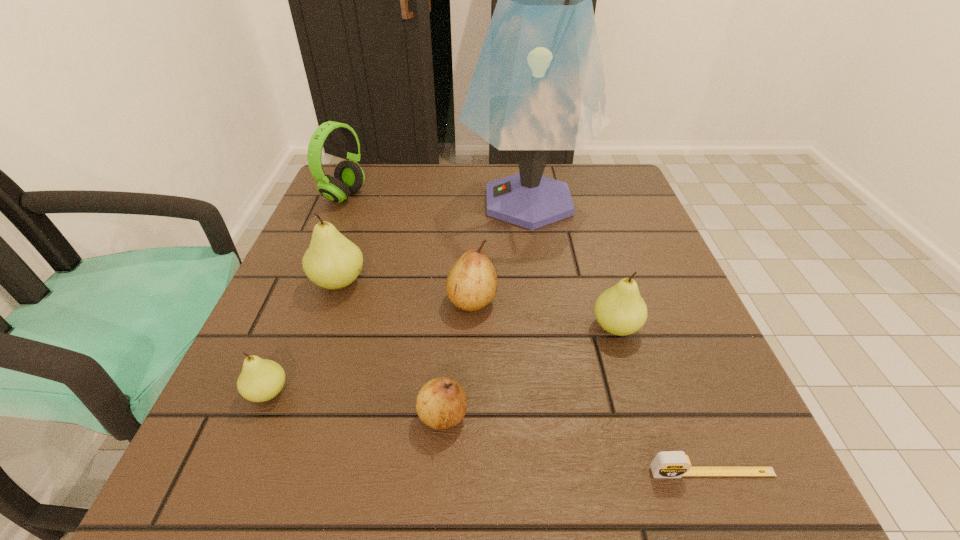
At what (x,y) coordinates should I click in order to perform the action: click on free space between the tallest object and the smaller brown pear. Please return your answer as a coordinate pair (x, y). The width and height of the screenshot is (960, 540). Looking at the image, I should click on (486, 308).

In order to click on free spot between the lampshade and the nearer brown pear in this screenshot , I will do `click(486, 308)`.

I want to click on vacant space that's between the green headset and the nearer brown pear, so click(x=394, y=306).

This screenshot has width=960, height=540. Identify the location of free space between the nearest object and the nearer brown pear. (578, 444).

This screenshot has width=960, height=540. In order to click on free space between the smaller brown pear and the second biggest green pear in this screenshot , I will do `click(529, 372)`.

In order to click on free area in between the green headset and the tallest object in this screenshot , I will do `click(437, 199)`.

This screenshot has width=960, height=540. Find the location of `empty location between the farthest green pear and the farther brown pear`. empty location between the farthest green pear and the farther brown pear is located at coordinates (405, 291).

I want to click on free space between the farther brown pear and the light lampshade, so click(x=500, y=251).

Locate which object is the sixth closest to the biggest green pear. Please provide its 2D coordinates. Your answer should be formatted as a tuple, i.e. [(x, y)], where the tuple contains the x and y coordinates of a point satisfying the conditions above.

[(620, 310)]

Select which object is the sixth closest to the light lampshade. Please provide its 2D coordinates. Your answer should be formatted as a tuple, i.e. [(x, y)], where the tuple contains the x and y coordinates of a point satisfying the conditions above.

[(261, 380)]